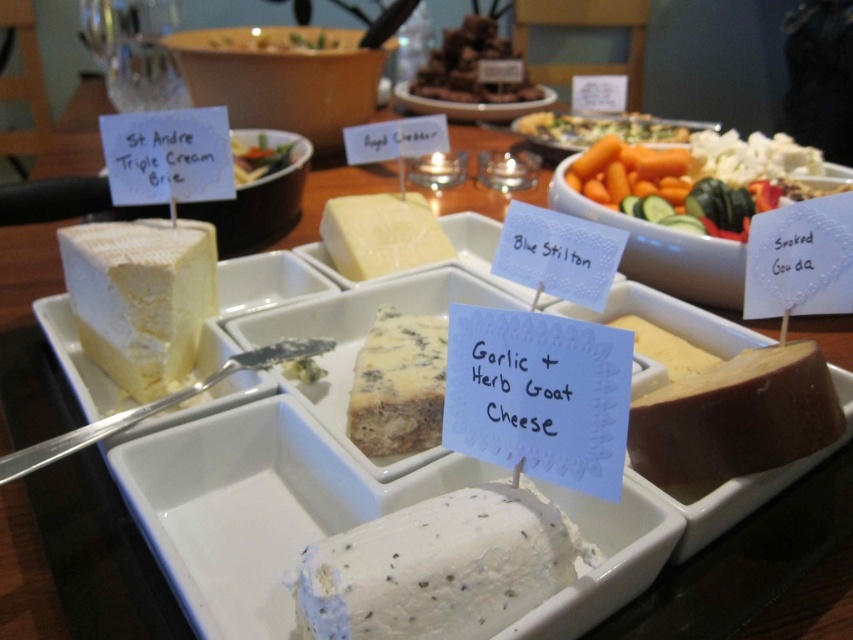
Question: In this image, where is dark chocolate cake at upper center located relative to white creamy cheese at upper right?

Choices:
 (A) right
 (B) left

Answer: (B)

Question: Which object appears closest to the camera in this image?

Choices:
 (A) white creamy cheese at upper right
 (B) dark chocolate cake at upper center
 (C) brown crumbly smoked gouda at center-right

Answer: (C)

Question: Where is white creamy cheese at upper right located in relation to brown crumbly smoked gouda at center-right in the image?

Choices:
 (A) below
 (B) above

Answer: (B)

Question: Is blue crumbly garlic + herb goat cheese at center wider than green leafy vegetable at center?

Choices:
 (A) no
 (B) yes

Answer: (A)

Question: Which is nearer to the white crumbly garlic + herb goat cheese at center?

Choices:
 (A) white creamy cheese at left
 (B) smooth white cheese at center

Answer: (A)

Question: Which point is farther from the camera taking this photo?

Choices:
 (A) (473, 12)
 (B) (492, 502)
 (C) (654, 132)
 (D) (180, 364)

Answer: (A)